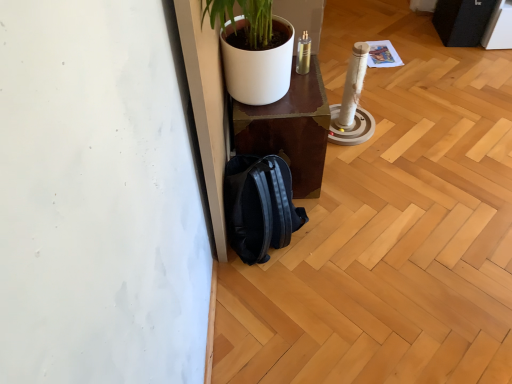
Locate an element on the screen. The width and height of the screenshot is (512, 384). vacant area that is in front of shiny brown table at center is located at coordinates [332, 241].